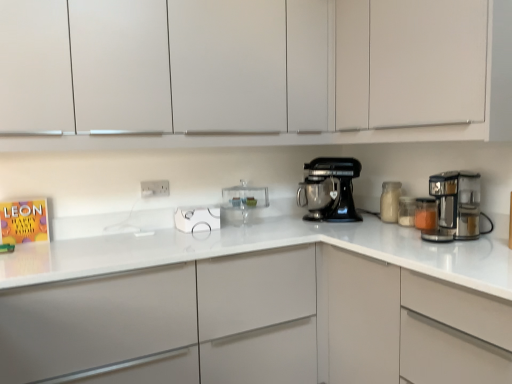
Question: Based on their positions, is white glass jar at right, which ranks as the third kitchen appliance in right-to-left order, located to the left or right of white matte cabinet at upper center, marked as the 2th cabinetry in a bottom-to-top arrangement?

Choices:
 (A) left
 (B) right

Answer: (B)

Question: Would you say white glass jar at right, which ranks as the third kitchen appliance in right-to-left order, is inside or outside white matte cabinet at upper center, positioned as the second cabinetry in top-to-bottom order?

Choices:
 (A) inside
 (B) outside

Answer: (B)

Question: Which is nearer to the white plastic electric outlet at center?

Choices:
 (A) white matte cabinet at upper center, the third cabinetry when ordered from bottom to top
 (B) translucent glass jar at right, which ranks as the second kitchen appliance in right-to-left order
 (C) white glass jar at right, which ranks as the third kitchen appliance in right-to-left order
 (D) transparent glass cake stand at center, acting as the first kitchen appliance starting from the left
 (E) white matte cabinet at upper center, positioned as the second cabinetry in top-to-bottom order

Answer: (D)

Question: Which object is the farthest from the black metallic stand mixer at center?

Choices:
 (A) white plastic electric outlet at center
 (B) white glass jar at right, marked as the 2th kitchen appliance in a left-to-right arrangement
 (C) translucent glass jar at right, placed as the 3th kitchen appliance when sorted from left to right
 (D) white matte cabinet at center, the first cabinetry in the bottom-to-top sequence
 (E) white matte cabinet at upper center, positioned as the second cabinetry in top-to-bottom order

Answer: (A)